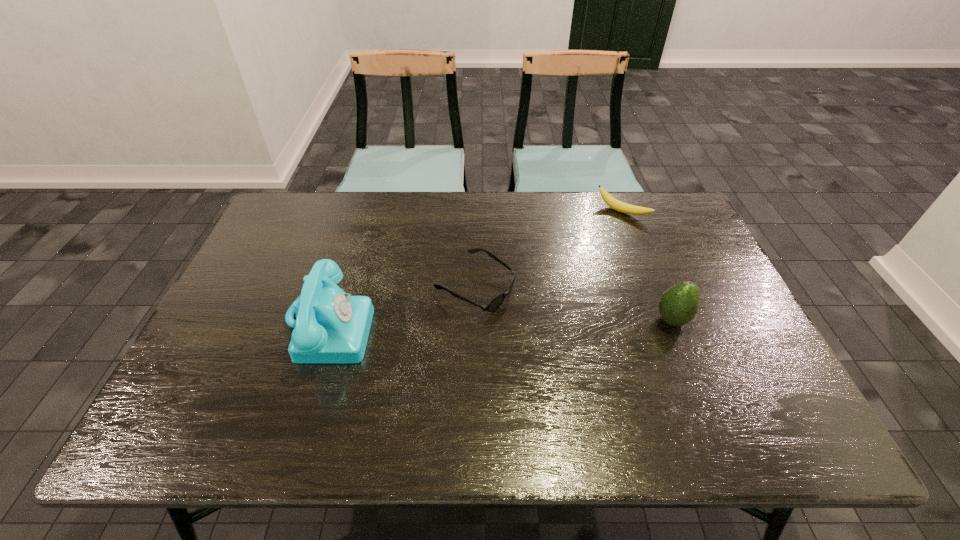
This screenshot has height=540, width=960. Identify the location of free point at the left edge. (253, 250).

The height and width of the screenshot is (540, 960). In the image, there is a desktop. Identify the location of vacant space at the right edge. (708, 338).

Identify the location of vacant space at the far left corner. The height and width of the screenshot is (540, 960). (302, 219).

In the image, there is a desktop. Where is `blank space at the far right corner`? The width and height of the screenshot is (960, 540). blank space at the far right corner is located at coordinates (691, 230).

In the image, there is a desktop. Identify the location of vacant region at the near right corner. (735, 382).

Where is `free point between the second object from left to right and the avocado`? Image resolution: width=960 pixels, height=540 pixels. free point between the second object from left to right and the avocado is located at coordinates (573, 303).

At what (x,y) coordinates should I click in order to perform the action: click on free point between the avocado and the third object from right to left. Please return your answer as a coordinate pair (x, y). The width and height of the screenshot is (960, 540). Looking at the image, I should click on (573, 303).

I want to click on empty location between the second tallest object and the farthest object, so click(647, 266).

Locate an element on the screen. This screenshot has width=960, height=540. empty space between the banana and the avocado is located at coordinates (647, 266).

Locate an element on the screen. free space between the banana and the sunglasses is located at coordinates (549, 249).